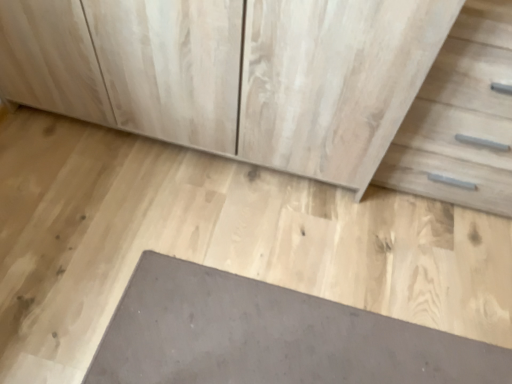
Question: Should I look upward or downward to see gray concrete at center?

Choices:
 (A) down
 (B) up

Answer: (A)

Question: Is slate at lower center bigger than gray concrete at center?

Choices:
 (A) no
 (B) yes

Answer: (A)

Question: Can you confirm if slate at lower center is taller than gray concrete at center?

Choices:
 (A) yes
 (B) no

Answer: (A)

Question: Can you confirm if slate at lower center is shorter than gray concrete at center?

Choices:
 (A) no
 (B) yes

Answer: (A)

Question: Is slate at lower center facing towards gray concrete at center?

Choices:
 (A) yes
 (B) no

Answer: (A)

Question: Does slate at lower center have a smaller size compared to gray concrete at center?

Choices:
 (A) yes
 (B) no

Answer: (A)

Question: Is slate at lower center oriented away from gray concrete at center?

Choices:
 (A) yes
 (B) no

Answer: (A)

Question: From the image's perspective, is slate at lower center located above light wood drawer at right?

Choices:
 (A) no
 (B) yes

Answer: (A)

Question: Is light wood drawer at right located within slate at lower center?

Choices:
 (A) no
 (B) yes

Answer: (A)

Question: Is the position of slate at lower center more distant than that of light wood drawer at right?

Choices:
 (A) yes
 (B) no

Answer: (A)

Question: Is slate at lower center not near light wood drawer at right?

Choices:
 (A) no
 (B) yes

Answer: (A)

Question: Considering the relative positions of slate at lower center and light wood drawer at right in the image provided, is slate at lower center to the left of light wood drawer at right from the viewer's perspective?

Choices:
 (A) yes
 (B) no

Answer: (A)

Question: Is slate at lower center positioned beyond the bounds of light wood drawer at right?

Choices:
 (A) yes
 (B) no

Answer: (A)

Question: From a real-world perspective, is gray concrete at center on slate at lower center?

Choices:
 (A) yes
 (B) no

Answer: (B)